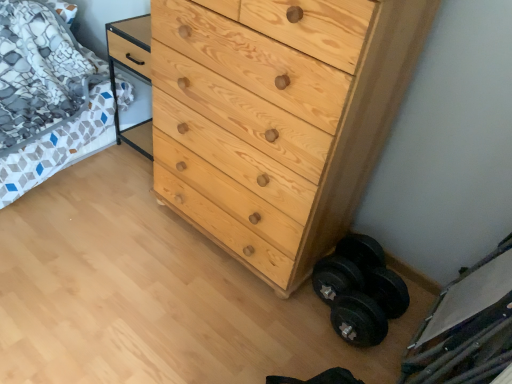
The image size is (512, 384). Find the location of `vacant space positioned to the left of black rubber dumbbell at lower right`. vacant space positioned to the left of black rubber dumbbell at lower right is located at coordinates (285, 318).